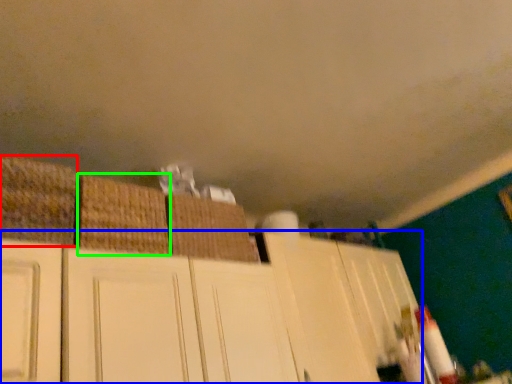
Question: Considering the real-world distances, which object is closest to basket (highlighted by a red box)? cabinetry (highlighted by a blue box) or basket (highlighted by a green box).

Choices:
 (A) cabinetry
 (B) basket

Answer: (B)